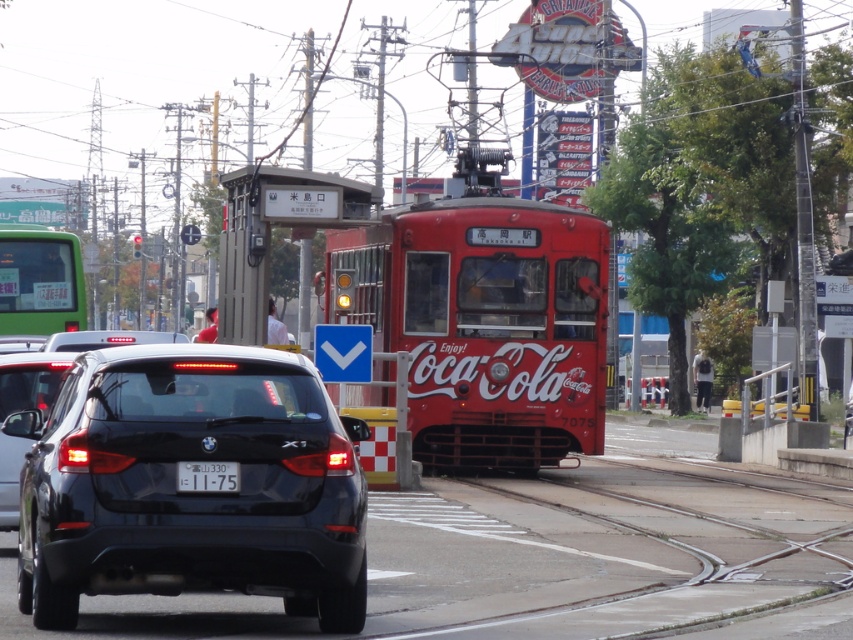
Question: Does black matte bmw x1 at center appear on the right side of black glossy car at lower left?

Choices:
 (A) yes
 (B) no

Answer: (A)

Question: Considering the relative positions of black matte bmw x1 at center and black glossy car at lower left in the image provided, where is black matte bmw x1 at center located with respect to black glossy car at lower left?

Choices:
 (A) right
 (B) left

Answer: (A)

Question: Is black matte bmw x1 at center above black glossy car at lower left?

Choices:
 (A) no
 (B) yes

Answer: (A)

Question: Which point is farther to the camera?

Choices:
 (A) (16, 355)
 (B) (209, 490)
 (C) (236, 374)

Answer: (A)

Question: Which object appears closest to the camera in this image?

Choices:
 (A) white plastic license plate at center
 (B) black glossy car at lower left

Answer: (A)

Question: Which object is closer to the camera taking this photo?

Choices:
 (A) black matte bmw x1 at center
 (B) black glossy car at lower left

Answer: (A)